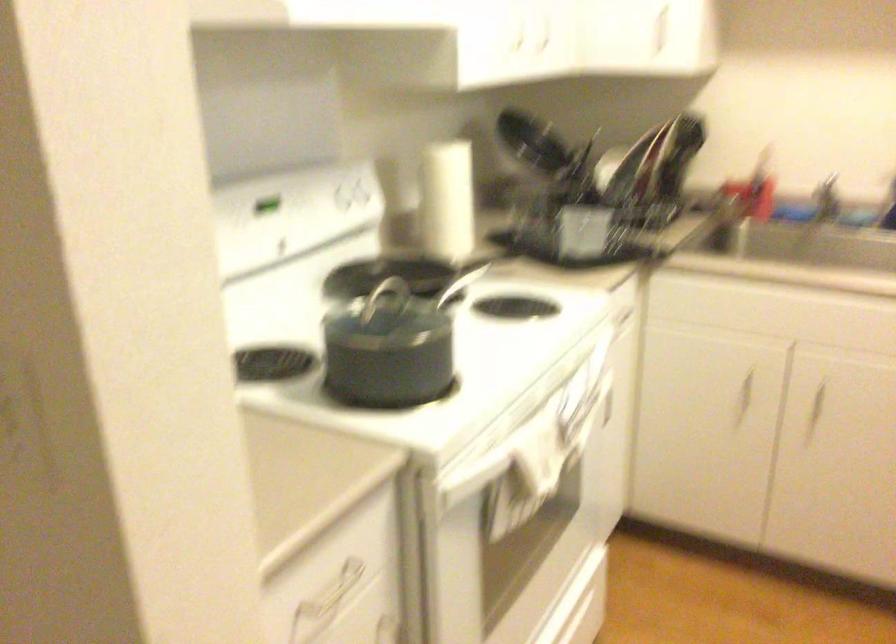
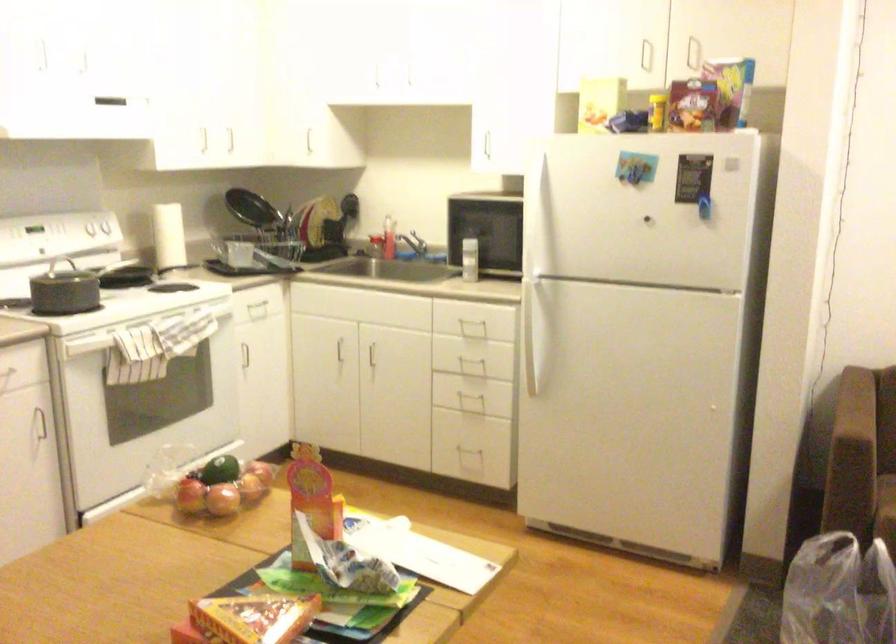
Locate, in the second image, the point that corresponds to [426,192] in the first image.

(168, 236)